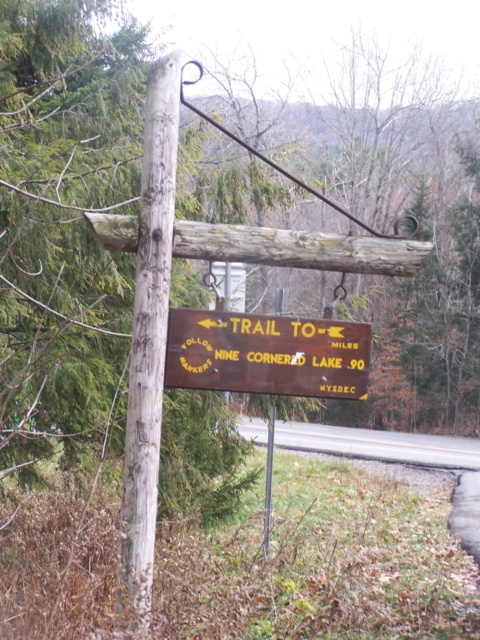
You are a hiker carrying a backpack and need to pass between the weathered wood pole at center and the brown wooden sign at center. Your backpack is 1 foot wide. Can you fit through the space between them?

The weathered wood pole at center is narrower than the brown wooden sign at center. However, the exact width of the space between them isn generated in the Objects Description. Therefore, it is uncertain if your 1 foot wide backpack can fit through the space between them.

You are a hiker trying to read the brown wooden sign at center. However, the weathered wood pole at center is blocking your view. Can you move around the pole to see the entire sign?

The weathered wood pole at center is in front of the brown wooden sign at center, so moving around the pole would allow you to see the entire sign.

You are a hiker who just arrived at the signpost. You need to determine the direction to head towards Nine Cornered Lake. The signpost has an arrow pointing to the right. Based on the coordinates of the weathered wood pole at center, which is point (x=148, y=342), can you determine if the arrow is pointing towards the lake?

The weathered wood pole at center is located at coordinates (x=148, y=342). Since the arrow on the signpost points to the right, and the sign indicates the trail to Nine Cornered Lake is 0.9 miles away, the arrow likely points in the direction of the lake. However, without additional spatial information about the terrain or the arrow direction relative to the pole coordinates, it is impossible to confirm definitively.